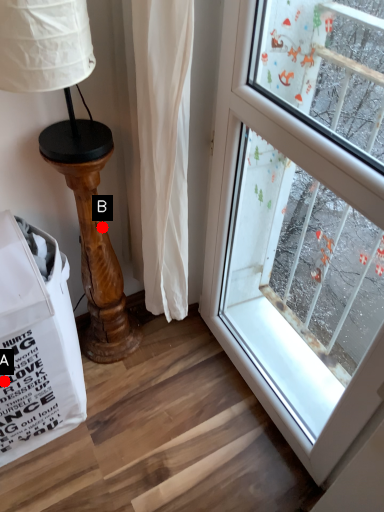
Question: Two points are circled on the image, labeled by A and B beside each circle. Which of the following is the closest to the observer?

Choices:
 (A) A is closer
 (B) B is closer

Answer: (A)